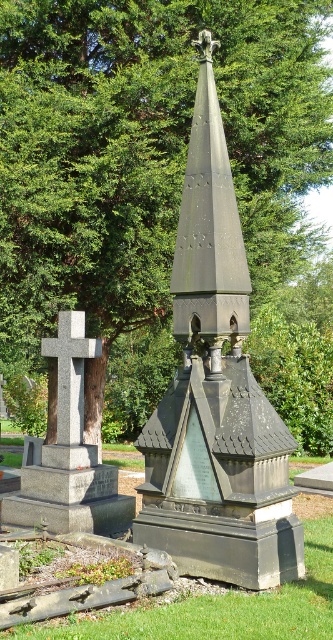
Is the position of granite cross at left more distant than that of granite cross at center?

That is False.

Can you confirm if granite cross at left is smaller than granite cross at center?

No, granite cross at left is not smaller than granite cross at center.

Is point (107, 522) in front of point (63, 360)?

No, (107, 522) is behind (63, 360).

What are the coordinates of `granite cross at left` in the screenshot? It's located at (69, 452).

Find the location of `dark gray stone monument at center`. dark gray stone monument at center is located at coordinates (216, 394).

Is dark gray stone monument at center bigger than granite cross at left?

Yes.

The image size is (333, 640). Describe the element at coordinates (216, 394) in the screenshot. I see `dark gray stone monument at center` at that location.

Find the location of `dark gray stone monument at center`. dark gray stone monument at center is located at coordinates (216, 394).

You are a GUI agent. You are given a task and a screenshot of the screen. Output one action in this format:
    pyautogui.click(x=<x>, y=<y>)
    Task: Click on the green leafy tree at upper center
    The width and height of the screenshot is (333, 640).
    Given the screenshot: What is the action you would take?
    pyautogui.click(x=144, y=152)

Locate an element on the screen. green leafy tree at upper center is located at coordinates (144, 152).

Locate an element on the screen. green leafy tree at upper center is located at coordinates (144, 152).